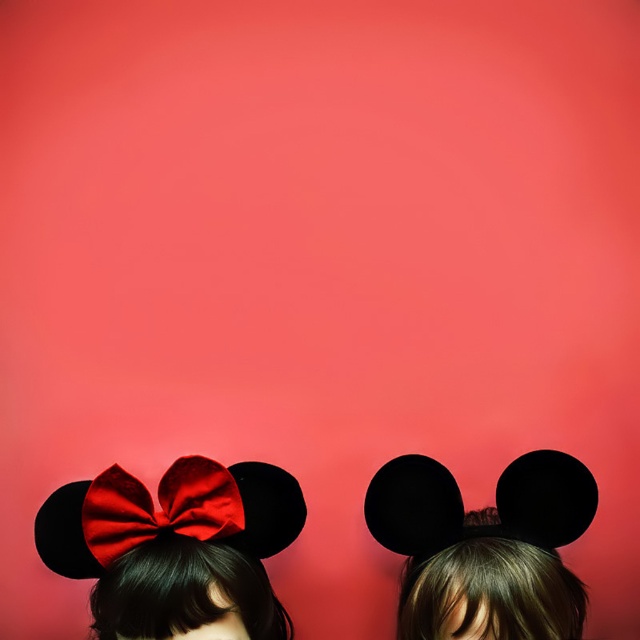
Can you confirm if satin red bow at upper left is shorter than satin red bow at center?

No, satin red bow at upper left is not shorter than satin red bow at center.

What do you see at coordinates (177, 548) in the screenshot?
I see `satin red bow at upper left` at bounding box center [177, 548].

Identify the location of satin red bow at upper left. (177, 548).

Who is shorter, black matte mouse ears at center or satin red bow at center?

Standing shorter between the two is satin red bow at center.

Does black matte mouse ears at center appear on the right side of satin red bow at center?

Indeed, black matte mouse ears at center is positioned on the right side of satin red bow at center.

Locate an element on the screen. This screenshot has width=640, height=640. black matte mouse ears at center is located at coordinates (484, 547).

Between satin red bow at upper left and black matte mouse ears at center, which one appears on the left side from the viewer's perspective?

satin red bow at upper left

Identify the location of satin red bow at upper left. point(177,548).

Measure the distance between satin red bow at upper left and camera.

satin red bow at upper left is 33.82 inches from camera.

The height and width of the screenshot is (640, 640). I want to click on satin red bow at upper left, so click(177, 548).